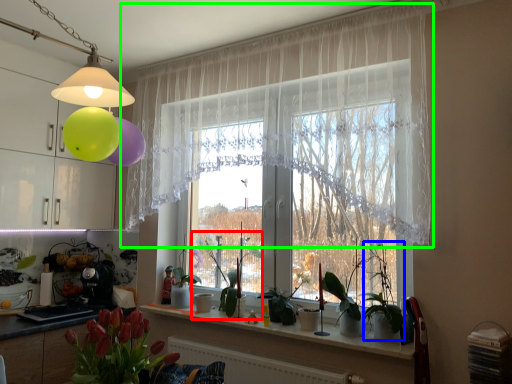
Question: Which object is the closest to the plant (highlighted by a red box)? Choose among these: plant (highlighted by a blue box) or curtain (highlighted by a green box).

Choices:
 (A) plant
 (B) curtain

Answer: (A)